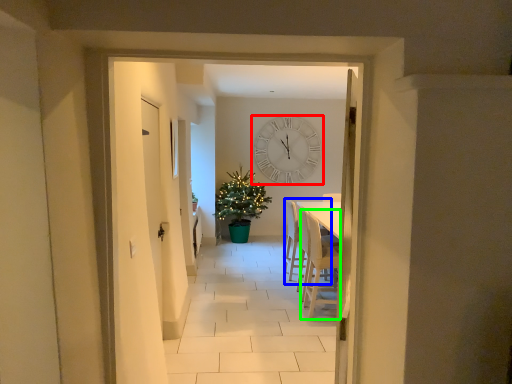
Question: Which is farther away from wall clock (highlighted by a red box)? armchair (highlighted by a blue box) or armchair (highlighted by a green box)?

Choices:
 (A) armchair
 (B) armchair

Answer: (B)